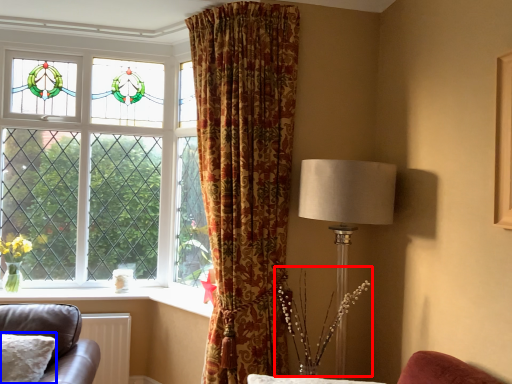
Question: Which of the following is the closest to the observer, floral arrangement (highlighted by a red box) or pillow (highlighted by a blue box)?

Choices:
 (A) floral arrangement
 (B) pillow

Answer: (B)